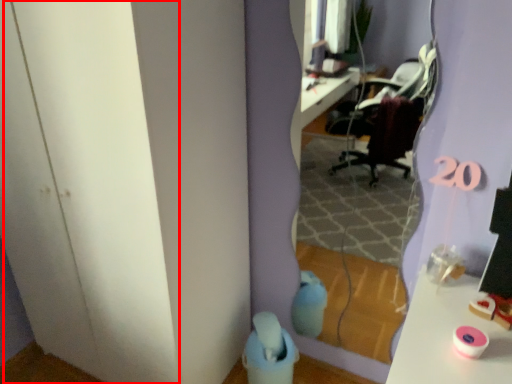
Question: From the image's perspective, what is the correct spatial positioning of glass door (annotated by the red box) in reference to mirror?

Choices:
 (A) above
 (B) below

Answer: (A)